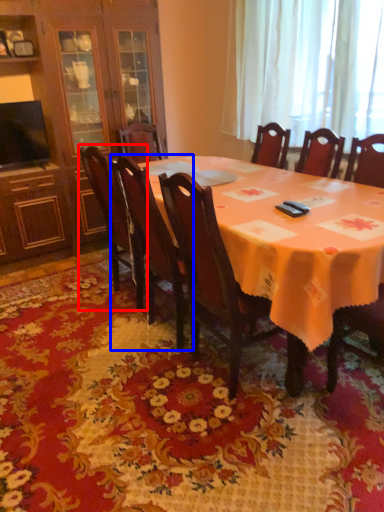
Question: Which point is closer to the camera, chair (highlighted by a red box) or chair (highlighted by a blue box)?

Choices:
 (A) chair
 (B) chair

Answer: (B)